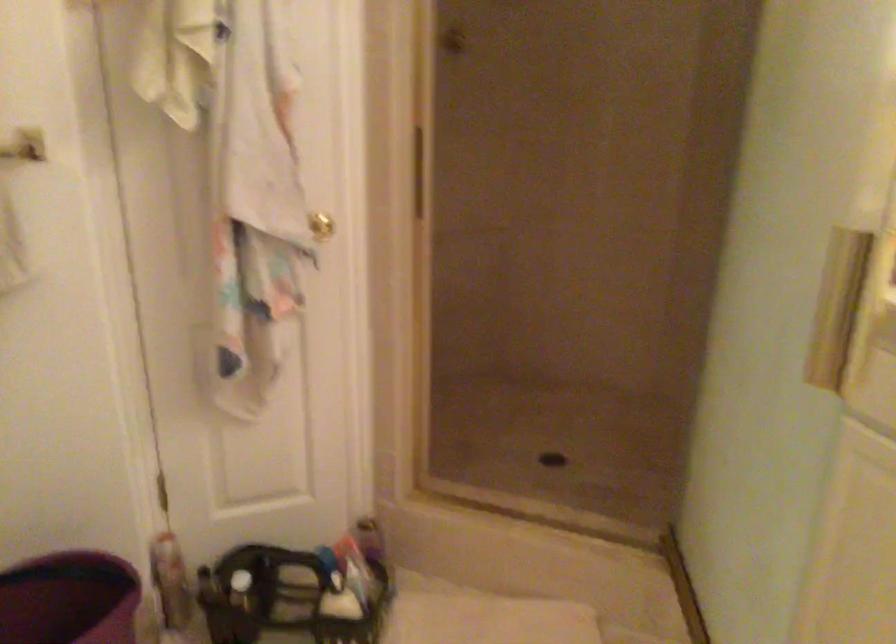
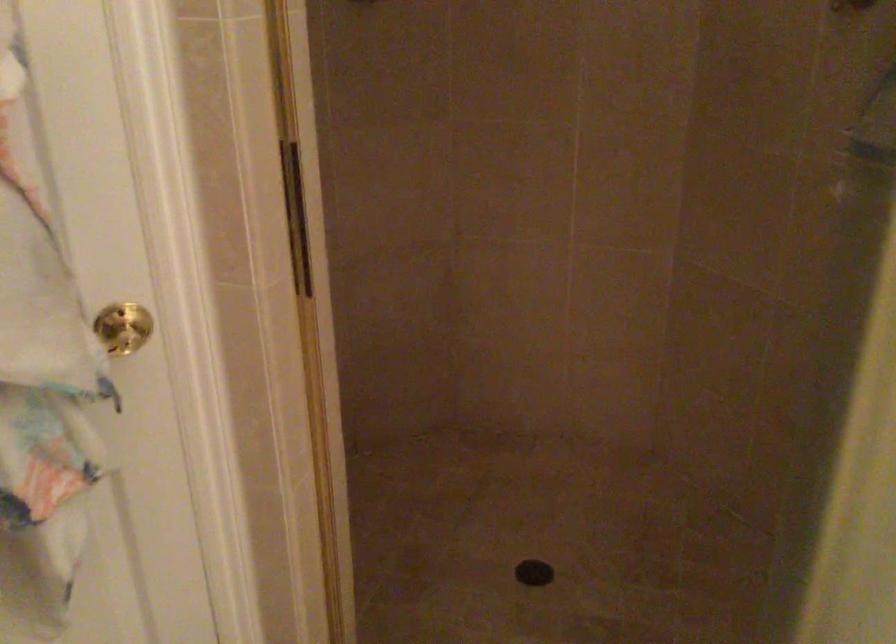
Question: In a continuous first-person perspective shot, in which direction is the camera moving?

Choices:
 (A) Left
 (B) Right
 (C) Forward
 (D) Backward

Answer: (C)